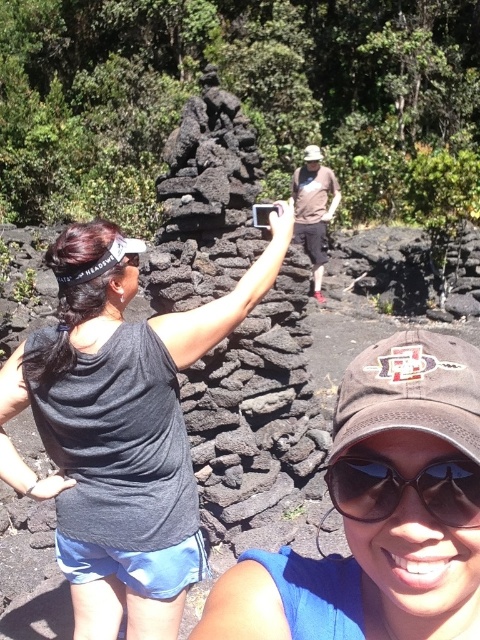
Question: From the image, what is the correct spatial relationship of matte black tank top at center in relation to brown fabric baseball cap at center?

Choices:
 (A) above
 (B) below

Answer: (B)

Question: Estimate the real-world distances between objects in this image. Which object is farther from the brown fabric baseball cap at center?

Choices:
 (A) brown matte shirt at center
 (B) brown fabric cap at center
 (C) black reflective sunglasses at lower center
 (D) matte black tank top at center

Answer: (A)

Question: Is the position of matte black tank top at center more distant than that of brown fabric baseball cap at center?

Choices:
 (A) no
 (B) yes

Answer: (B)

Question: Which object appears farthest from the camera in this image?

Choices:
 (A) brown matte shirt at center
 (B) brown fabric baseball cap at center
 (C) matte black tank top at center
 (D) brown fabric baseball hat at center

Answer: (D)

Question: Which point is farther from the camera taking this photo?

Choices:
 (A) pyautogui.click(x=326, y=209)
 (B) pyautogui.click(x=405, y=568)
 (C) pyautogui.click(x=80, y=237)

Answer: (A)

Question: Is matte black tank top at center above brown fabric baseball hat at center?

Choices:
 (A) no
 (B) yes

Answer: (A)